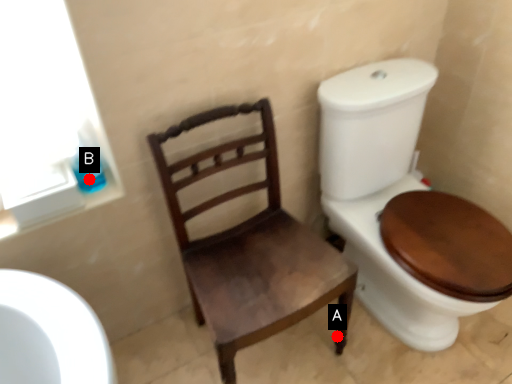
Question: Two points are circled on the image, labeled by A and B beside each circle. Which point is further to the camera?

Choices:
 (A) A is further
 (B) B is further

Answer: (A)